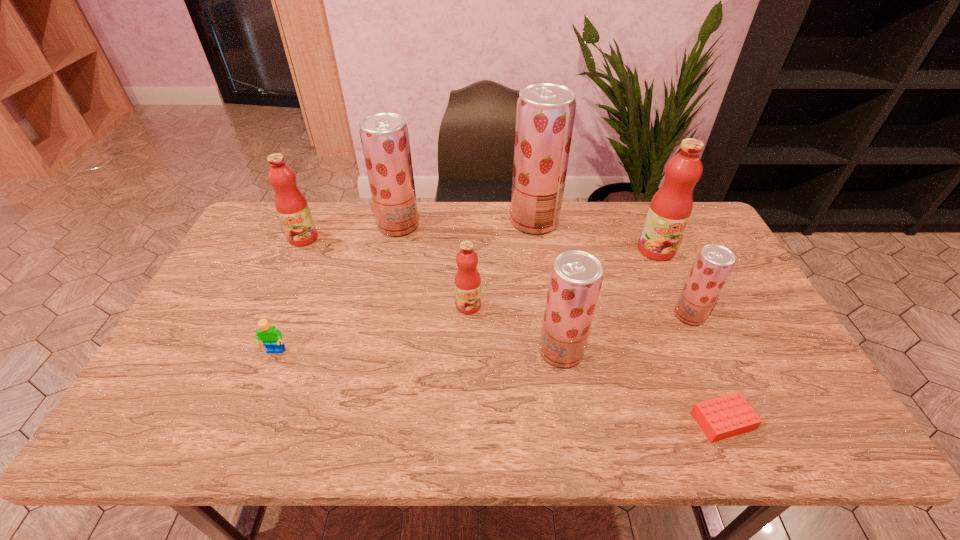
Locate an element on the screen. the second closest pink fruit juice to the fourth object from left to right is located at coordinates (670, 208).

Locate an element on the screen. The width and height of the screenshot is (960, 540). vacant space that satisfies the following two spatial constraints: 1. on the front label of the sixth object from right to left; 2. on the left side of the shorter Lego is located at coordinates (466, 421).

This screenshot has width=960, height=540. I want to click on vacant space that satisfies the following two spatial constraints: 1. on the front label of the smallest pink fruit juice; 2. on the right side of the third biggest strawberry fruit juice, so click(468, 351).

Locate an element on the screen. blank space that satisfies the following two spatial constraints: 1. on the front label of the rightmost strawberry fruit juice; 2. on the right side of the second smallest pink fruit juice is located at coordinates (268, 315).